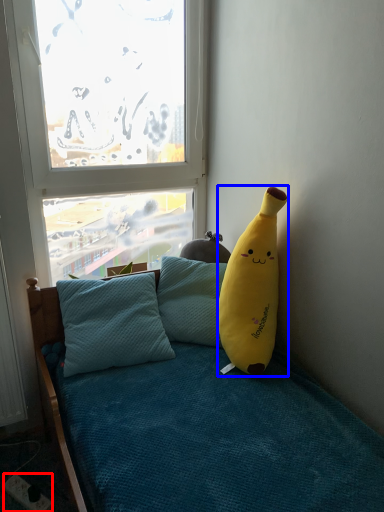
Question: Which point is closer to the camera, power outlet (highlighted by a red box) or banana (highlighted by a blue box)?

Choices:
 (A) power outlet
 (B) banana

Answer: (B)